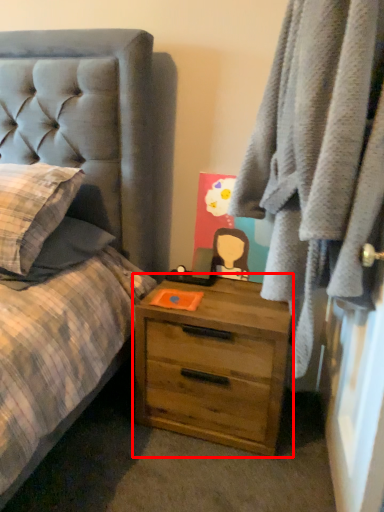
Question: From the image's perspective, what is the correct spatial relationship of chest of drawers (annotated by the red box) in relation to clothing?

Choices:
 (A) below
 (B) above

Answer: (A)